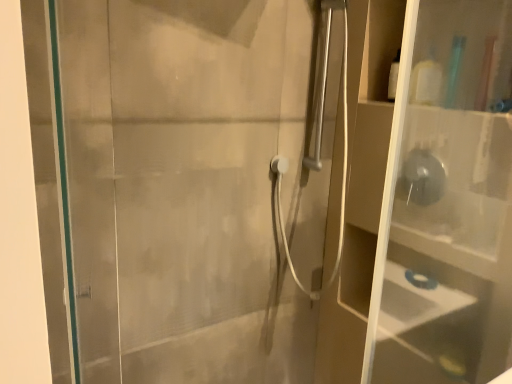
Question: Considering the relative sizes of transparent glass screen door at left and white matte bottle at upper right in the image provided, is transparent glass screen door at left shorter than white matte bottle at upper right?

Choices:
 (A) yes
 (B) no

Answer: (B)

Question: Does transparent glass screen door at left have a greater height compared to white matte bottle at upper right?

Choices:
 (A) yes
 (B) no

Answer: (A)

Question: Is transparent glass screen door at left positioned with its back to white matte bottle at upper right?

Choices:
 (A) yes
 (B) no

Answer: (B)

Question: Can you confirm if transparent glass screen door at left is bigger than white matte bottle at upper right?

Choices:
 (A) yes
 (B) no

Answer: (A)

Question: From the image's perspective, would you say transparent glass screen door at left is positioned over white matte bottle at upper right?

Choices:
 (A) no
 (B) yes

Answer: (A)

Question: From the image's perspective, is white matte bottle at upper right positioned above or below transparent glass screen door at left?

Choices:
 (A) below
 (B) above

Answer: (B)

Question: Considering the positions of white matte bottle at upper right and transparent glass screen door at left in the image, is white matte bottle at upper right taller or shorter than transparent glass screen door at left?

Choices:
 (A) tall
 (B) short

Answer: (B)

Question: In the image, is white matte bottle at upper right on the left side or the right side of transparent glass screen door at left?

Choices:
 (A) left
 (B) right

Answer: (B)

Question: Looking at their shapes, would you say white matte bottle at upper right is wider or thinner than transparent glass screen door at left?

Choices:
 (A) thin
 (B) wide

Answer: (B)

Question: In terms of height, does transparent glass screen door at left look taller or shorter compared to white matte bottle at upper right?

Choices:
 (A) short
 (B) tall

Answer: (B)

Question: Is point (224, 337) closer or farther from the camera than point (424, 66)?

Choices:
 (A) closer
 (B) farther

Answer: (B)

Question: Is transparent glass screen door at left in front of or behind white matte bottle at upper right in the image?

Choices:
 (A) front
 (B) behind

Answer: (A)

Question: Looking at the image, does transparent glass screen door at left seem bigger or smaller compared to white matte bottle at upper right?

Choices:
 (A) small
 (B) big

Answer: (B)

Question: Is white matte bottle at upper right to the left or to the right of transparent plastic shelf at right in the image?

Choices:
 (A) left
 (B) right

Answer: (A)

Question: In the image, is white matte bottle at upper right positioned in front of or behind transparent plastic shelf at right?

Choices:
 (A) front
 (B) behind

Answer: (B)